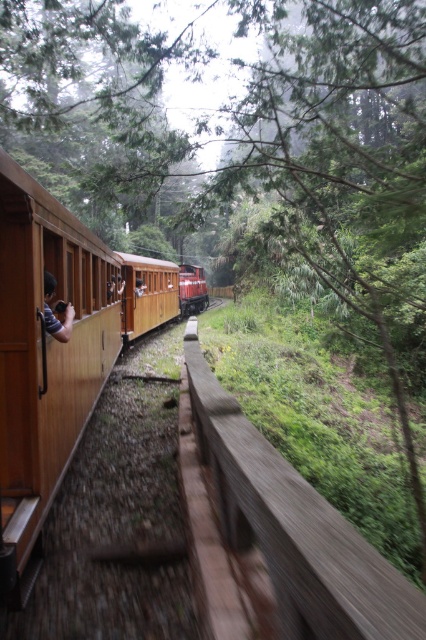
Does brown wooden rail at center lie in front of brown wooden person at left?

Yes, it is in front of brown wooden person at left.

Is brown wooden rail at center wider than brown wooden person at left?

Correct, the width of brown wooden rail at center exceeds that of brown wooden person at left.

Does point (218, 452) come behind point (118, 282)?

No, (218, 452) is closer to viewer.

Where is `brown wooden rail at center`? The height and width of the screenshot is (640, 426). brown wooden rail at center is located at coordinates (294, 529).

In the scene shown: Who is taller, wooden train at left or brown wooden person at left?

wooden train at left is taller.

Who is positioned more to the left, wooden train at left or brown wooden person at left?

Positioned to the left is brown wooden person at left.

Which is in front, point (20, 301) or point (112, 282)?

Point (20, 301) is in front.

The width and height of the screenshot is (426, 640). In order to click on wooden train at left in this screenshot , I will do `click(45, 358)`.

Does wooden train at left appear over brown wooden rail at center?

Yes, wooden train at left is above brown wooden rail at center.

Who is taller, wooden train at left or brown wooden rail at center?

wooden train at left

Who is more forward, (48, 365) or (288, 588)?

Point (288, 588) is more forward.

You are a GUI agent. You are given a task and a screenshot of the screen. Output one action in this format:
    pyautogui.click(x=<x>, y=<y>)
    Task: Click on the wooden train at left
    The height and width of the screenshot is (640, 426).
    Given the screenshot: What is the action you would take?
    pyautogui.click(x=45, y=358)